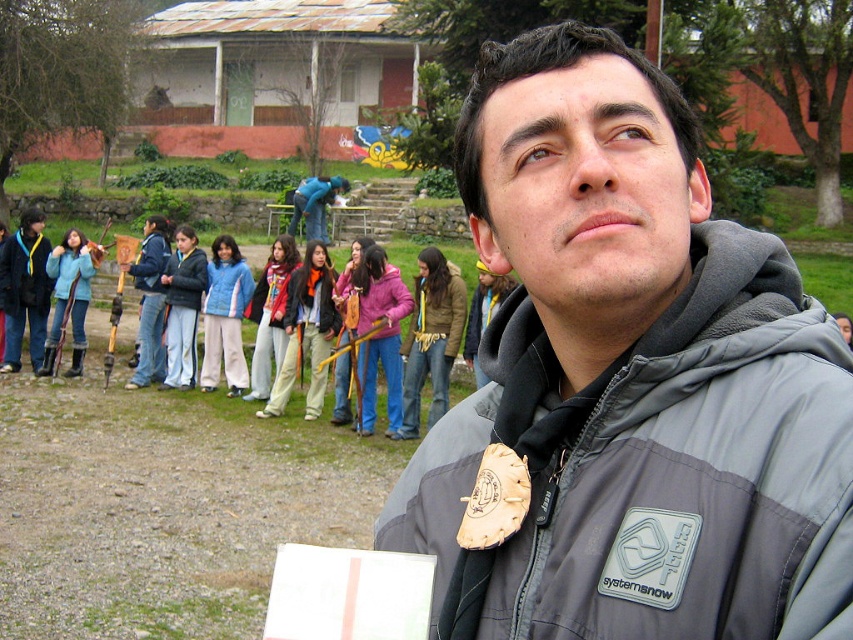
Question: Does gray synthetic jacket at center have a smaller size compared to blue fleece jacket at left?

Choices:
 (A) yes
 (B) no

Answer: (A)

Question: Which of the following is the farthest from the observer?

Choices:
 (A) gray synthetic jacket at center
 (B) blue fleece jacket at left

Answer: (B)

Question: Which of the following is the closest to the observer?

Choices:
 (A) blue fleece jacket at left
 (B) gray synthetic jacket at center

Answer: (B)

Question: Is gray synthetic jacket at center positioned at the back of blue fleece jacket at left?

Choices:
 (A) no
 (B) yes

Answer: (A)

Question: Which of the following is the closest to the observer?

Choices:
 (A) gray synthetic jacket at center
 (B) blue fleece jacket at left

Answer: (A)

Question: Is gray synthetic jacket at center above blue fleece jacket at left?

Choices:
 (A) yes
 (B) no

Answer: (B)